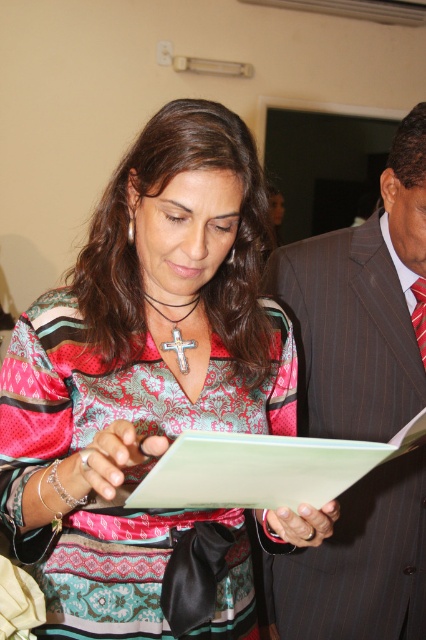
Does patterned fabric blouse at center appear over multicolored woven tie at right?

Incorrect, patterned fabric blouse at center is not positioned above multicolored woven tie at right.

Is point (111, 266) more distant than point (422, 323)?

No, (111, 266) is closer to viewer.

At what (x,y) coordinates should I click in order to perform the action: click on patterned fabric blouse at center. Please return your answer as a coordinate pair (x, y). Image resolution: width=426 pixels, height=640 pixels. Looking at the image, I should click on (147, 388).

Can you confirm if patterned fabric blouse at center is bigger than light green paper at center?

Indeed, patterned fabric blouse at center has a larger size compared to light green paper at center.

Can you confirm if patterned fabric blouse at center is wider than light green paper at center?

Yes.

Between point (74, 524) and point (287, 461), which one is positioned in front?

Point (287, 461)

This screenshot has height=640, width=426. Find the location of `patterned fabric blouse at center`. patterned fabric blouse at center is located at coordinates (147, 388).

Does point (83, 364) come farther from viewer compared to point (310, 368)?

No, (83, 364) is in front of (310, 368).

Is patterned fabric blouse at center positioned before striped suit at center?

That is True.

This screenshot has height=640, width=426. What are the coordinates of `patterned fabric blouse at center` in the screenshot? It's located at (147, 388).

The height and width of the screenshot is (640, 426). I want to click on patterned fabric blouse at center, so click(147, 388).